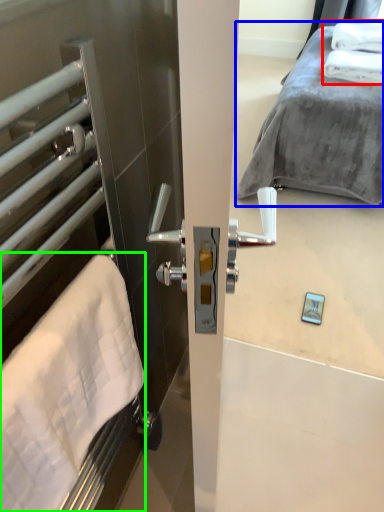
Question: Based on their relative distances, which object is farther from bath towel (highlighted by a red box)? Choose from bed (highlighted by a blue box) and bath towel (highlighted by a green box).

Choices:
 (A) bed
 (B) bath towel

Answer: (B)